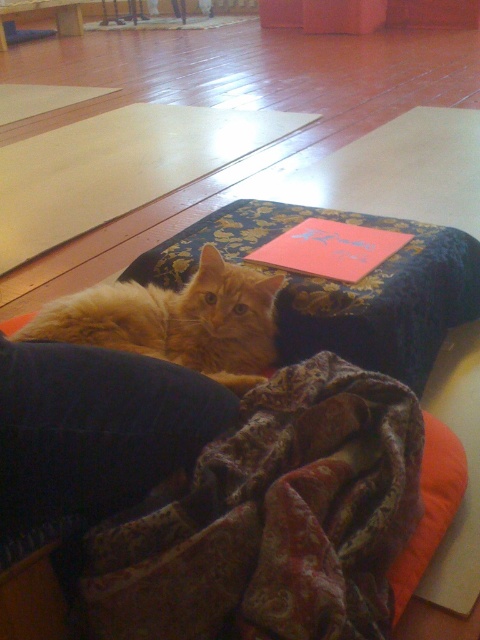
Question: Observing the image, what is the correct spatial positioning of blue floral fabric yoga mat at center in reference to orange fabric pillow at lower right?

Choices:
 (A) above
 (B) below

Answer: (A)

Question: In this image, where is fluffy orange cat at center located relative to smooth red paper at center?

Choices:
 (A) left
 (B) right

Answer: (A)

Question: Is orange fabric pillow at lower right in front of smooth red paper at center?

Choices:
 (A) no
 (B) yes

Answer: (B)

Question: Which of the following is the farthest from the observer?

Choices:
 (A) (339, 278)
 (B) (324, 545)
 (C) (190, 285)
 (D) (285, 317)

Answer: (D)

Question: Which object is the farthest from the blue floral fabric yoga mat at center?

Choices:
 (A) smooth red paper at center
 (B) orange fabric pillow at lower right
 (C) fluffy orange cat at center

Answer: (B)

Question: Considering the real-world distances, which object is closest to the velvet-like brown blanket at lower center?

Choices:
 (A) orange fabric pillow at lower right
 (B) fluffy orange cat at center
 (C) smooth red paper at center

Answer: (A)